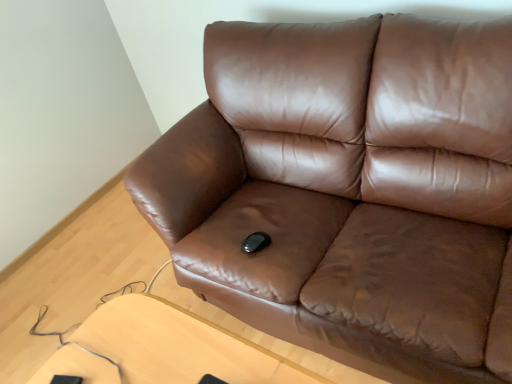
Identify the location of empty space that is ontop of light brown wooden table at lower center (from a real-world perspective). The height and width of the screenshot is (384, 512). (157, 346).